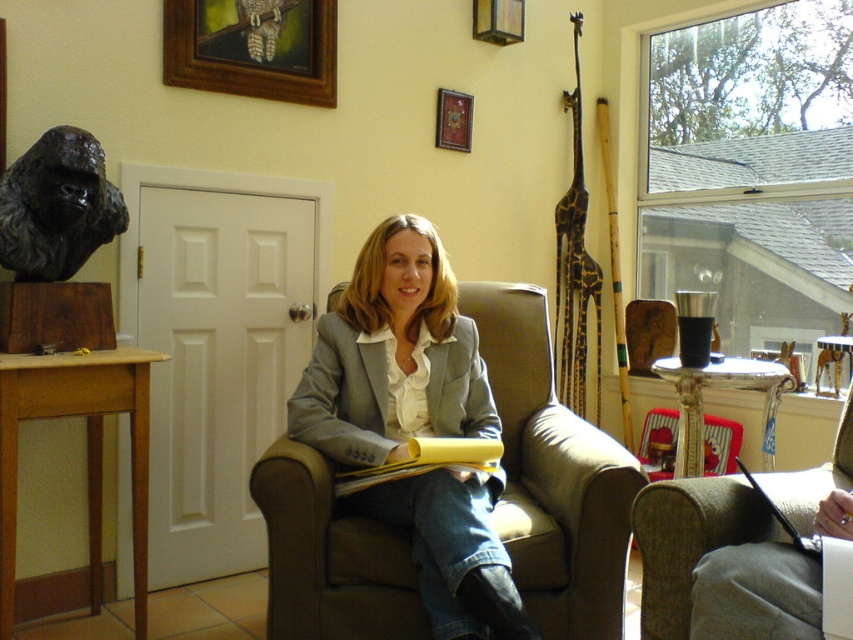
Question: Considering the relative positions of matte gray blazer at center and wooden picture frame at upper left in the image provided, where is matte gray blazer at center located with respect to wooden picture frame at upper left?

Choices:
 (A) right
 (B) left

Answer: (A)

Question: Estimate the real-world distances between objects in this image. Which object is farther from the matte gray blazer at center?

Choices:
 (A) velvet red armchair at lower right
 (B) wooden picture frame at upper center
 (C) wooden picture frame at upper left
 (D) black bronze gorilla head at left

Answer: (A)

Question: Can you confirm if velvet red armchair at lower right is positioned below wooden picture frame at upper center?

Choices:
 (A) no
 (B) yes

Answer: (B)

Question: Does matte gray blazer at center lie in front of wooden picture frame at upper left?

Choices:
 (A) yes
 (B) no

Answer: (A)

Question: Considering the real-world distances, which object is closest to the black bronze gorilla head at left?

Choices:
 (A) wooden picture frame at upper center
 (B) matte gray blazer at center
 (C) velvet red armchair at lower right
 (D) wooden picture frame at upper left

Answer: (D)

Question: Considering the real-world distances, which object is closest to the velvet red armchair at lower right?

Choices:
 (A) matte gray blazer at center
 (B) black bronze gorilla head at left
 (C) wooden picture frame at upper left
 (D) wooden picture frame at upper center

Answer: (A)